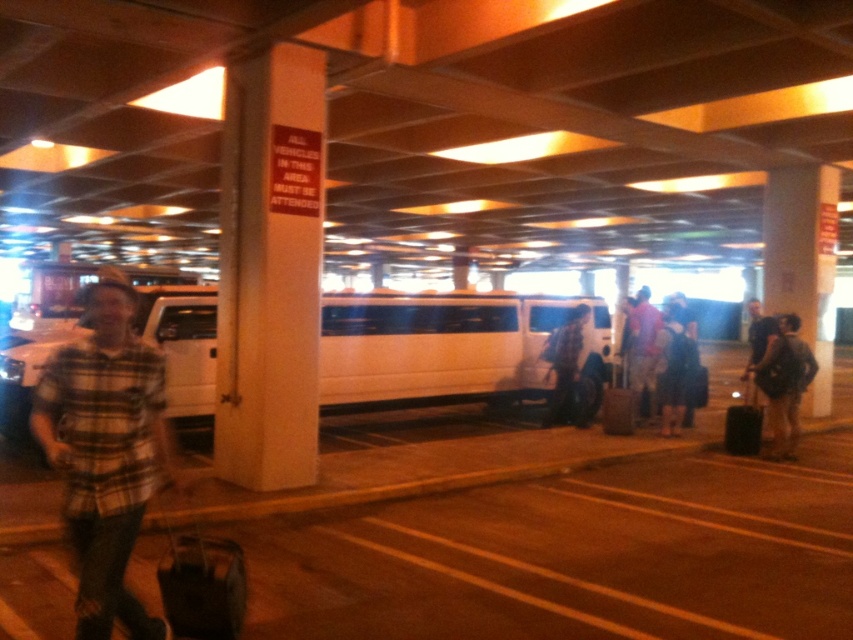
Does plaid fabric shirt at left appear on the right side of light blue shirt at center?

No, plaid fabric shirt at left is not to the right of light blue shirt at center.

You are a GUI agent. You are given a task and a screenshot of the screen. Output one action in this format:
    pyautogui.click(x=<x>, y=<y>)
    Task: Click on the plaid fabric shirt at left
    This screenshot has width=853, height=640.
    Given the screenshot: What is the action you would take?
    pyautogui.click(x=106, y=451)

Looking at this image, does white matte van at center have a lesser width compared to black matte suitcase at lower right?

Correct, white matte van at center's width is less than black matte suitcase at lower right's.

Can you confirm if white matte van at center is positioned below black matte suitcase at lower right?

No.

Who is more forward, (491,342) or (724,445)?

Point (724,445)

I want to click on white matte van at center, so click(448, 346).

Identify the location of plaid fabric shirt at left. (106, 451).

Is plaid fabric shirt at left above dark gray backpack at lower right?

Yes.

Describe the element at coordinates (106, 451) in the screenshot. The image size is (853, 640). I see `plaid fabric shirt at left` at that location.

Find the location of `plaid fabric shirt at left`. plaid fabric shirt at left is located at coordinates (106, 451).